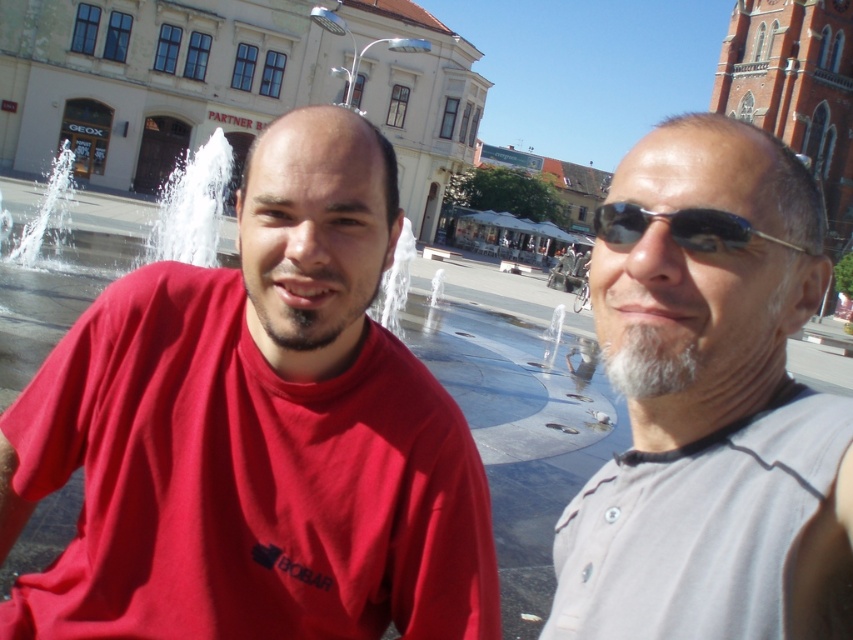
You are taking a photo of two people in a public square. You notice the dark brown stubble at left and the black plastic sunglasses at right. Which object is located more to the left?

The dark brown stubble at left is positioned on the left side of black plastic sunglasses at right, so the dark brown stubble at left is more to the left.